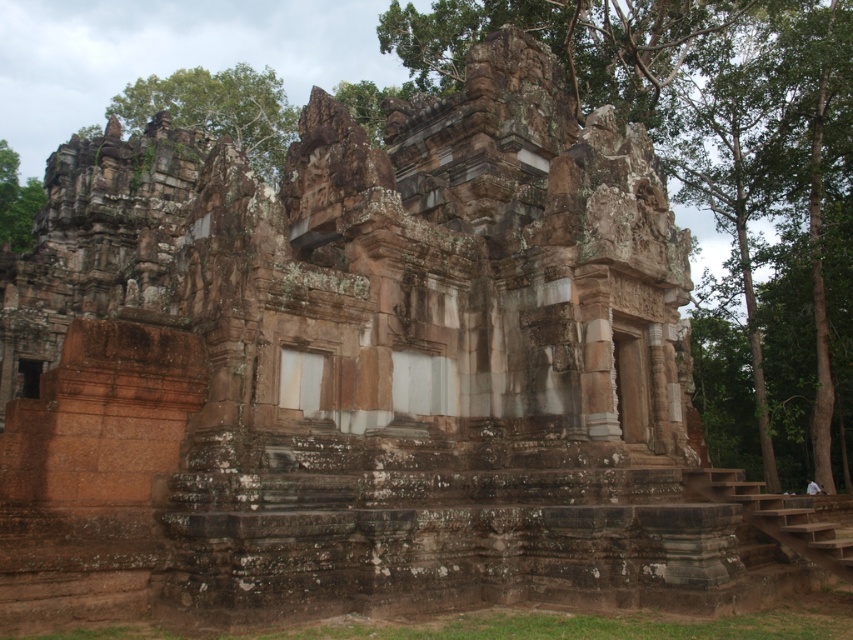
Question: Which of the following is the closest to the observer?

Choices:
 (A) green mossy tree at upper left
 (B) green leafy tree at upper left
 (C) green mossy stone temple at center

Answer: (C)

Question: Which point is closer to the camera taking this photo?

Choices:
 (A) (219, 92)
 (B) (820, 330)

Answer: (B)

Question: Is green mossy stone temple at center positioned behind green leafy tree at upper left?

Choices:
 (A) no
 (B) yes

Answer: (A)

Question: Which of the following is the closest to the observer?

Choices:
 (A) green mossy tree at upper left
 (B) green mossy stone temple at center

Answer: (B)

Question: Is green leafy tree at upper left closer to camera compared to green mossy tree at upper left?

Choices:
 (A) no
 (B) yes

Answer: (A)

Question: Does green mossy stone temple at center have a greater width compared to green mossy tree at upper left?

Choices:
 (A) no
 (B) yes

Answer: (B)